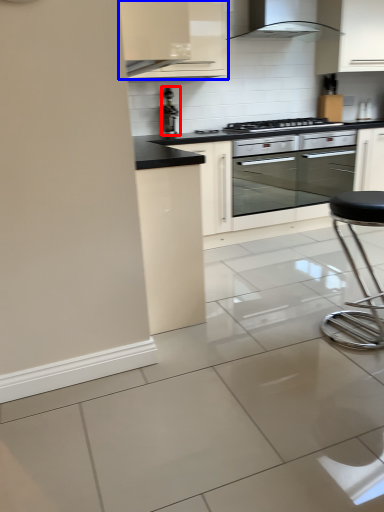
Question: Which object appears closest to the camera in this image, appliance (highlighted by a red box) or cabinetry (highlighted by a blue box)?

Choices:
 (A) appliance
 (B) cabinetry

Answer: (B)